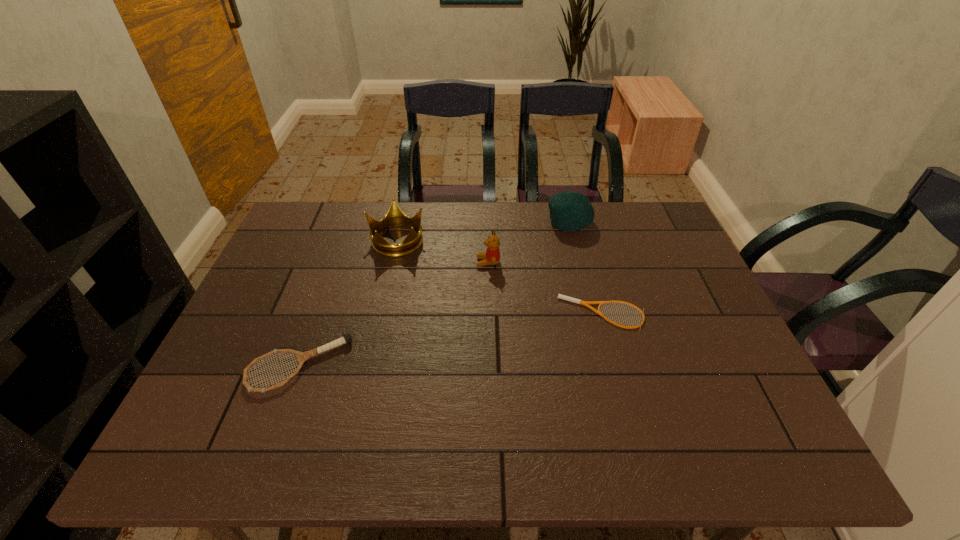
This screenshot has width=960, height=540. What are the coordinates of `free space at the right edge` in the screenshot? It's located at (681, 321).

Image resolution: width=960 pixels, height=540 pixels. Find the location of `free space at the far left corner of the desktop`. free space at the far left corner of the desktop is located at coordinates (300, 217).

Find the location of `blank space at the far right corner of the desktop`. blank space at the far right corner of the desktop is located at coordinates (622, 214).

Where is `free space that is in between the right tennis racket and the crown`? The image size is (960, 540). free space that is in between the right tennis racket and the crown is located at coordinates (499, 276).

At what (x,y) coordinates should I click in order to perform the action: click on free spot between the beanie and the crown. Please return your answer as a coordinate pair (x, y). Looking at the image, I should click on (483, 231).

At what (x,y) coordinates should I click in order to perform the action: click on free spot between the second shortest object and the shortest object. Please return your answer as a coordinate pair (x, y). The width and height of the screenshot is (960, 540). Looking at the image, I should click on (450, 339).

Locate an element on the screen. free spot between the right tennis racket and the taller tennis racket is located at coordinates (450, 339).

Find the location of a particular element. blank region between the fourth tallest object and the crown is located at coordinates (348, 302).

The image size is (960, 540). In order to click on unoccupied position between the farther tennis racket and the third object from right to left in this screenshot , I will do `click(545, 288)`.

I want to click on vacant space that's between the crown and the third object from right to left, so click(x=443, y=251).